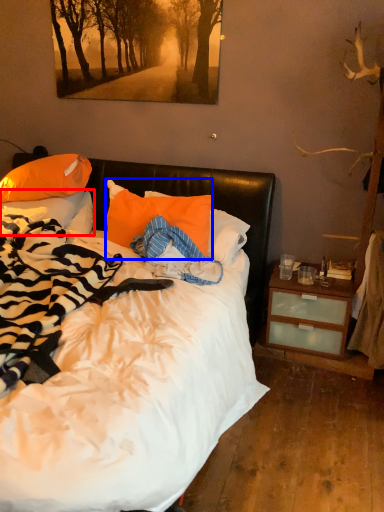
Question: Among these objects, which one is farthest to the camera, pillow (highlighted by a red box) or pillow (highlighted by a blue box)?

Choices:
 (A) pillow
 (B) pillow

Answer: (A)